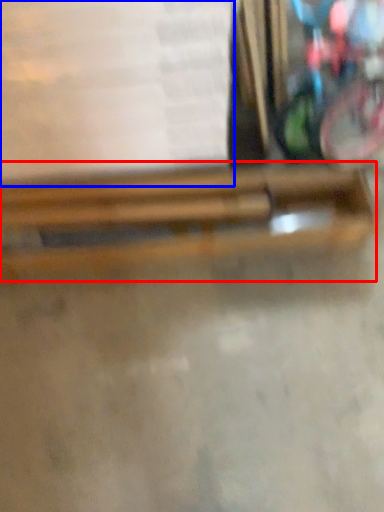
Question: Which object is further to the camera taking this photo, wood (highlighted by a red box) or paperback book (highlighted by a blue box)?

Choices:
 (A) wood
 (B) paperback book

Answer: (A)